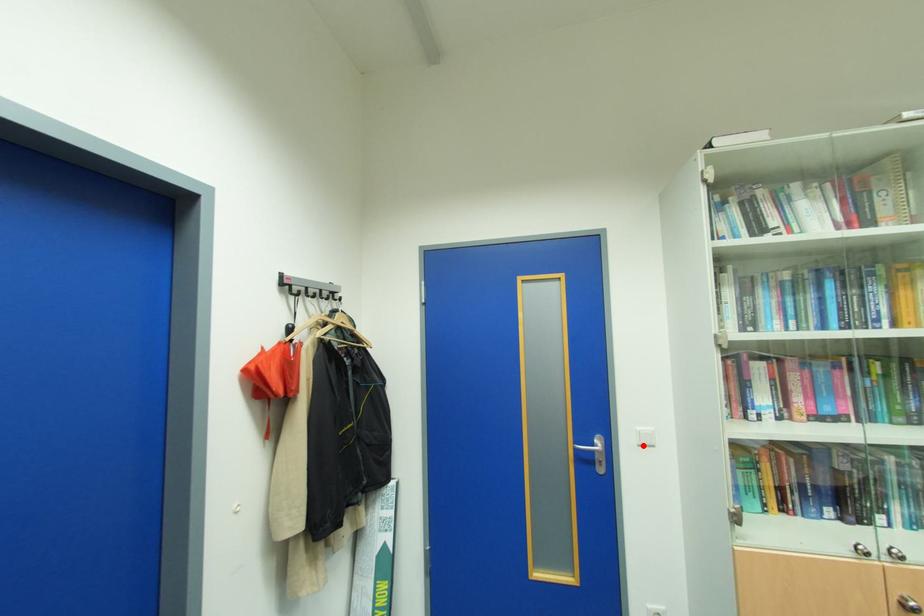
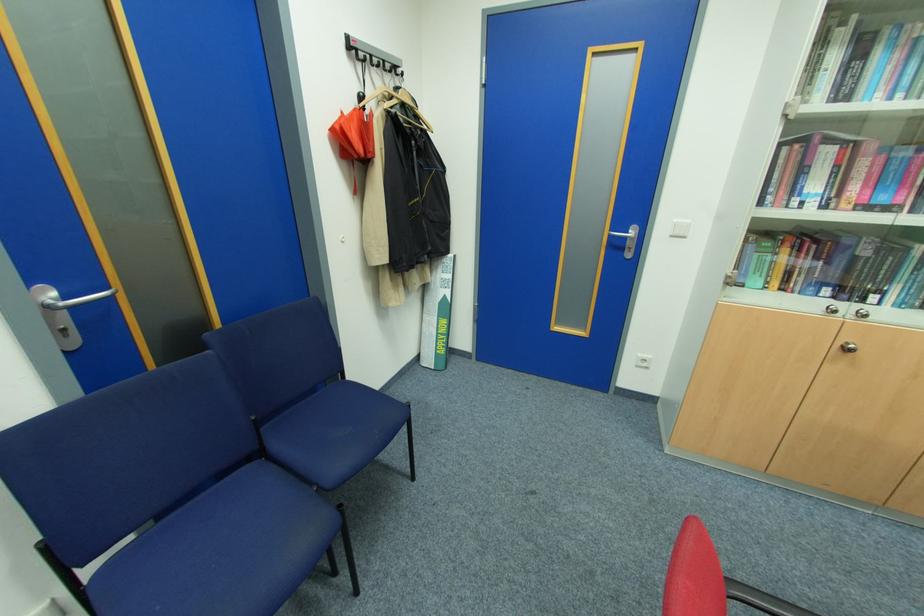
Question: A red point is marked in image1. In image2, is the corresponding 3D point closer to the camera or farther? Reply with the corresponding letter.

Choices:
 (A) The corresponding 3D point is closer.
 (B) The corresponding 3D point is farther.

Answer: (A)